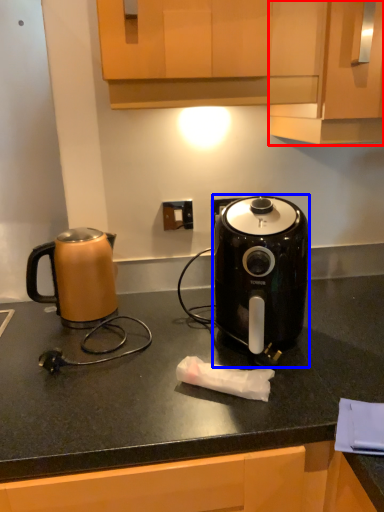
Question: Which object is closer to the camera taking this photo, cabinetry (highlighted by a red box) or toaster (highlighted by a blue box)?

Choices:
 (A) cabinetry
 (B) toaster

Answer: (A)